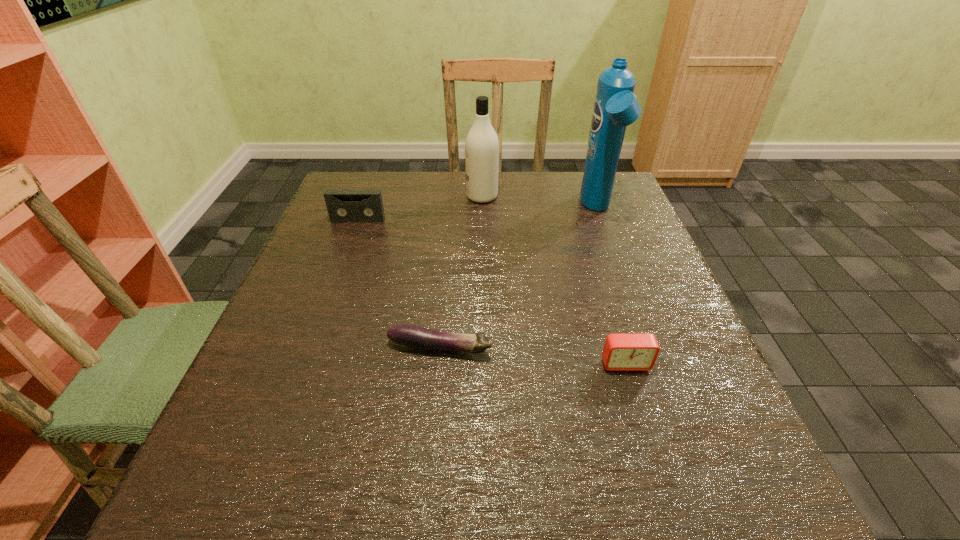
The image size is (960, 540). Identify the location of vacant space that satisfies the following two spatial constraints: 1. on the front-facing side of the right shampoo; 2. on the right side of the left shampoo. (482, 210).